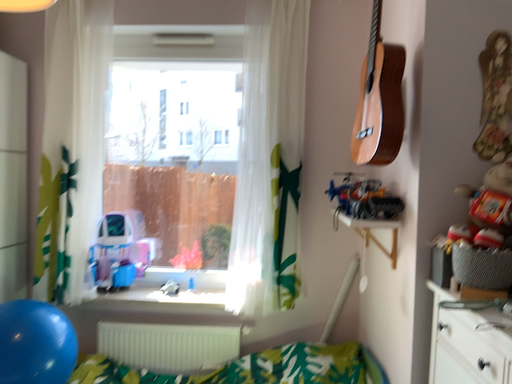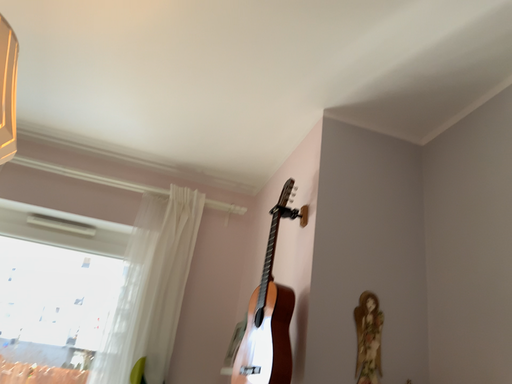
Question: How did the camera likely rotate when shooting the video?

Choices:
 (A) rotated left
 (B) rotated right

Answer: (B)